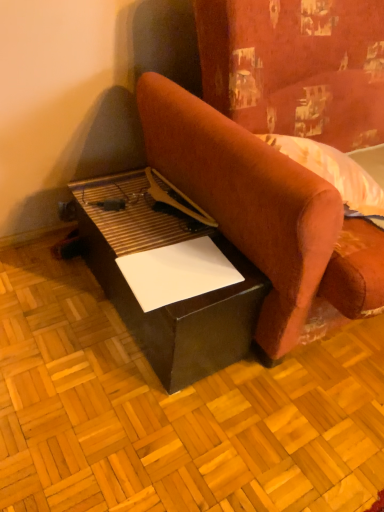
This screenshot has height=512, width=384. I want to click on free spot below white paper at lower center (from a real-world perspective), so click(x=182, y=273).